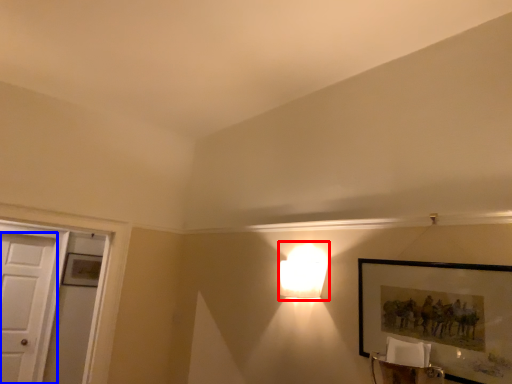
Question: Which object appears farthest to the camera in this image, lamp (highlighted by a red box) or door (highlighted by a blue box)?

Choices:
 (A) lamp
 (B) door

Answer: (B)